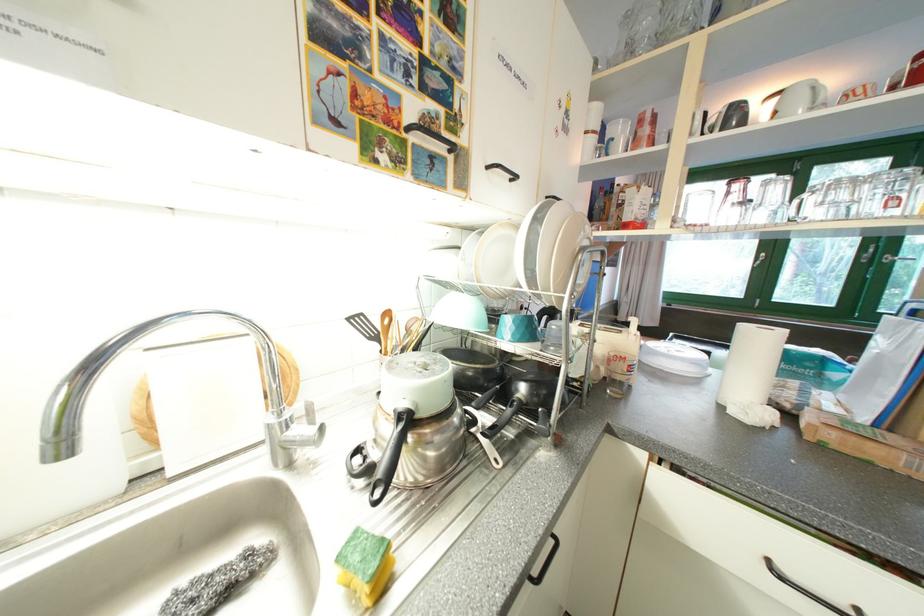
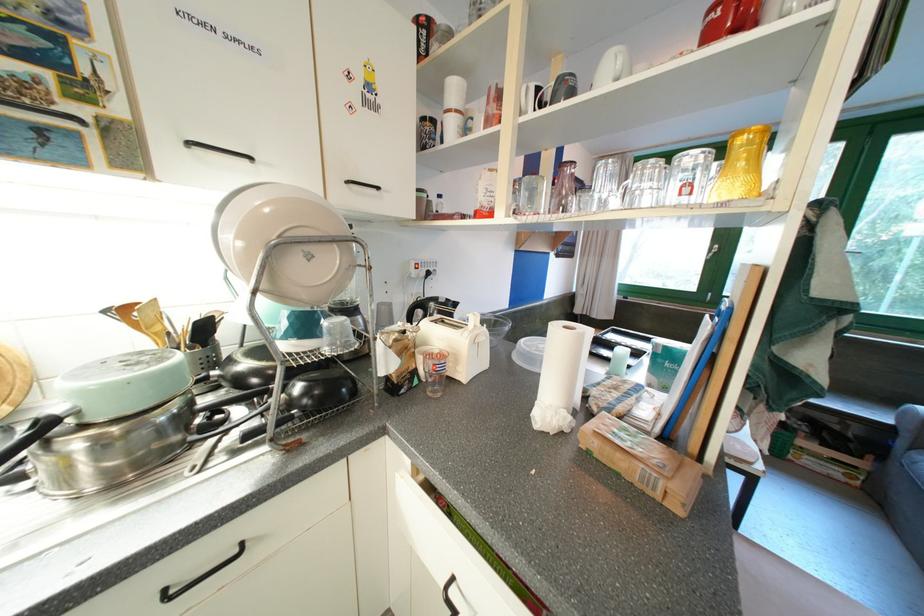
The point at (713, 116) is marked in the first image. Where is the corresponding point in the second image?

(545, 91)